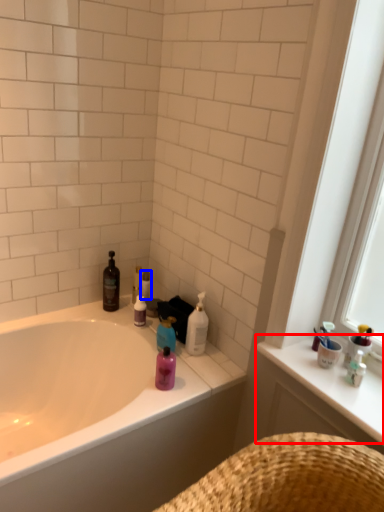
Question: Which object is closer to the camera taking this photo, counter top (highlighted by a red box) or toilet paper (highlighted by a blue box)?

Choices:
 (A) counter top
 (B) toilet paper

Answer: (A)